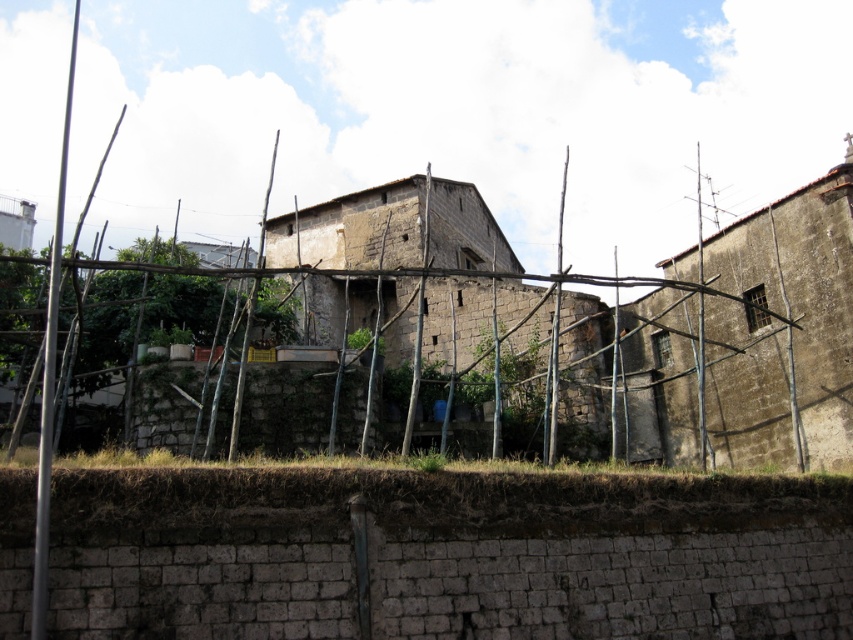
Question: Which point is farther to the camera?

Choices:
 (A) (306, 216)
 (B) (376, 630)
 (C) (749, 372)

Answer: (A)

Question: Estimate the real-world distances between objects in this image. Which object is farther from the brown dirt at lower center?

Choices:
 (A) weathered stone hut at center
 (B) rustic stone hut at right

Answer: (A)

Question: Observing the image, what is the correct spatial positioning of brown dirt at lower center in reference to rustic stone hut at right?

Choices:
 (A) right
 (B) left

Answer: (B)

Question: Does brown dirt at lower center lie behind weathered stone hut at center?

Choices:
 (A) yes
 (B) no

Answer: (B)

Question: Is brown dirt at lower center positioned at the back of weathered stone hut at center?

Choices:
 (A) no
 (B) yes

Answer: (A)

Question: Among these objects, which one is nearest to the camera?

Choices:
 (A) rustic stone hut at right
 (B) brown dirt at lower center
 (C) weathered stone hut at center

Answer: (B)